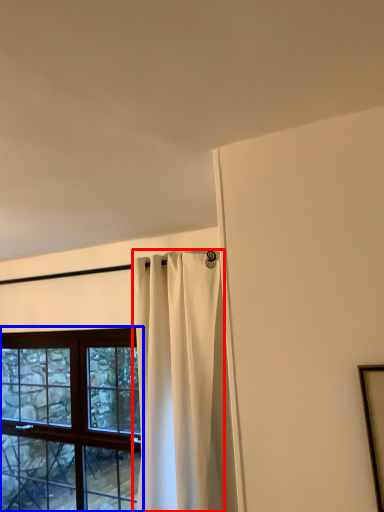
Question: Which of the following is the farthest to the observer, curtain (highlighted by a red box) or window (highlighted by a blue box)?

Choices:
 (A) curtain
 (B) window

Answer: (B)